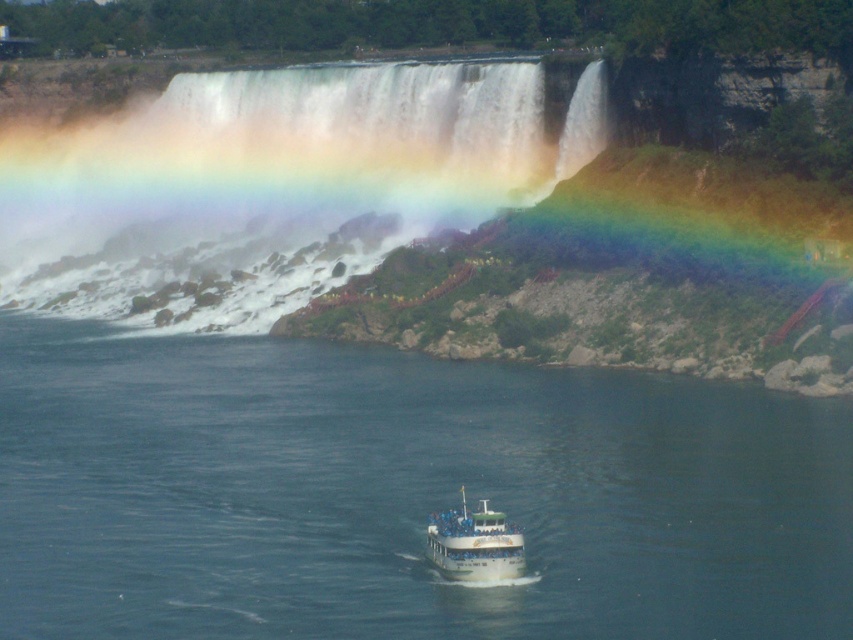
You are standing at the observation deck near the edge of Niagara Falls. You want to take a photo of the rainbow that forms an arc in the mist above the falls. To do this, you need to know how far you should move forward or backward to frame the rainbow properly. The camera you are using has a focal length of 50mm and a sensor size of 24mm x 36mm. The rainbow spans an angle of 42 degrees in the sky. Given that the point at coordinate (206,312) in the image corresponds to a real distance of 110.47 meters,

The point at coordinate (206,312) is 110.47 meters away from the camera. Since the rainbow spans an angle of 42 degrees, you can use trigonometry to calculate the optimal distance. The formula for the angle of view is angle in radians equals 2 times arctangent of half the sensor dimension divided by focal length. However, since the rainbow spans 42 degrees, you need to ensure that the camera is positioned such that this angle fits within the sensor dimensions. The distance to the rainbow can be approxim

You are standing at the edge of Niagara Falls and notice the clear blue water at center. Based on its position, can you determine if this water is closer to you or further away compared to the base of the falls?

The clear blue water at center is located at point 0.772 on the x and y axis, which places it closer to the base of the falls, so it is further away from you than the edge where you are standing.

You are a photographer standing at the base of the falls. You want to capture a photo of both the white misty waterfall at upper center and the white glossy boat at center. Based on their sizes, which object should you focus on first to ensure both are clearly visible in the frame?

The white misty waterfall at upper center is larger in size than the white glossy boat at center. To ensure both are clearly visible, focus on the larger waterfall first, then adjust the framing to include the smaller boat.